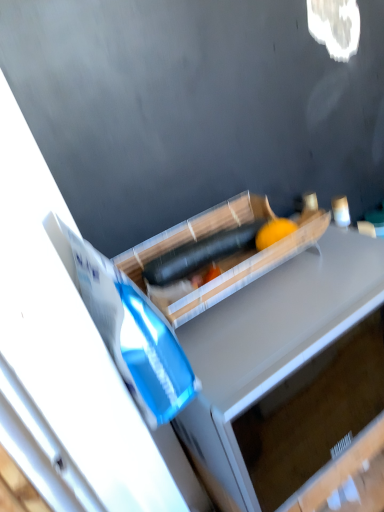
Find the location of a particular element. The image size is (384, 512). space that is in front of wooden tray at center is located at coordinates (274, 330).